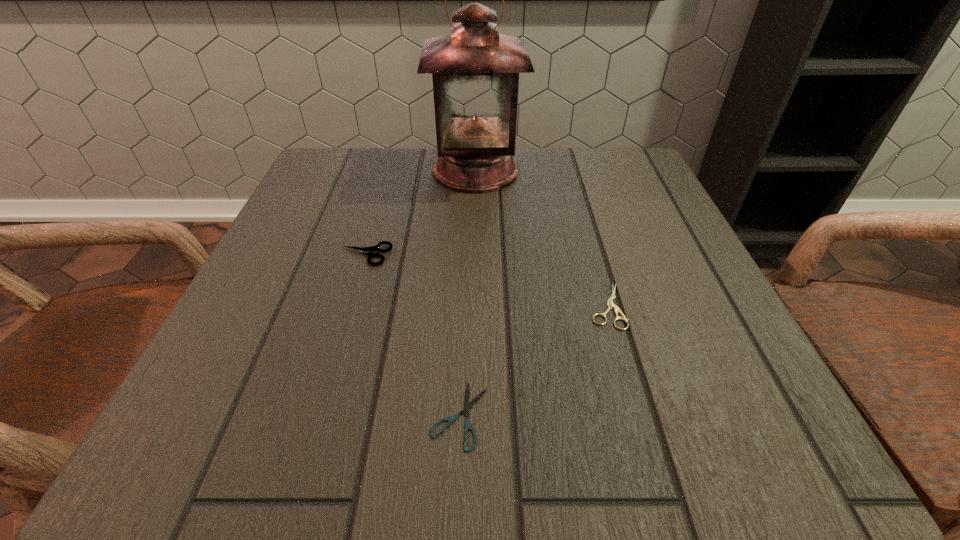
This screenshot has width=960, height=540. I want to click on vacant space at the near right corner of the desktop, so click(721, 414).

The width and height of the screenshot is (960, 540). I want to click on vacant area between the farthest object and the leftmost shears, so click(x=420, y=213).

The image size is (960, 540). In order to click on vacant point located between the shortest object and the farthest object in this screenshot , I will do `click(468, 293)`.

I want to click on vacant region between the tallest object and the shortest shears, so click(468, 293).

Find the location of a particular element. The width and height of the screenshot is (960, 540). vacant area between the second shears from left to right and the tallest object is located at coordinates (468, 293).

You are a GUI agent. You are given a task and a screenshot of the screen. Output one action in this format:
    pyautogui.click(x=<x>, y=<y>)
    Task: Click on the free spot between the nearest object and the oil lamp
    
    Given the screenshot: What is the action you would take?
    pyautogui.click(x=468, y=293)

Find the location of a particular element. vacant space that is in between the oil lamp and the nearest shears is located at coordinates (468, 293).

Where is `free area in between the nearest shears and the oil lamp`? The height and width of the screenshot is (540, 960). free area in between the nearest shears and the oil lamp is located at coordinates (468, 293).

At what (x,y) coordinates should I click in order to perform the action: click on vacant space that's between the nearest object and the second farthest object. Please return your answer as a coordinate pair (x, y). This screenshot has width=960, height=540. Looking at the image, I should click on (413, 335).

Locate an element on the screen. This screenshot has width=960, height=540. free space that is in between the tallest object and the shortest object is located at coordinates (468, 293).